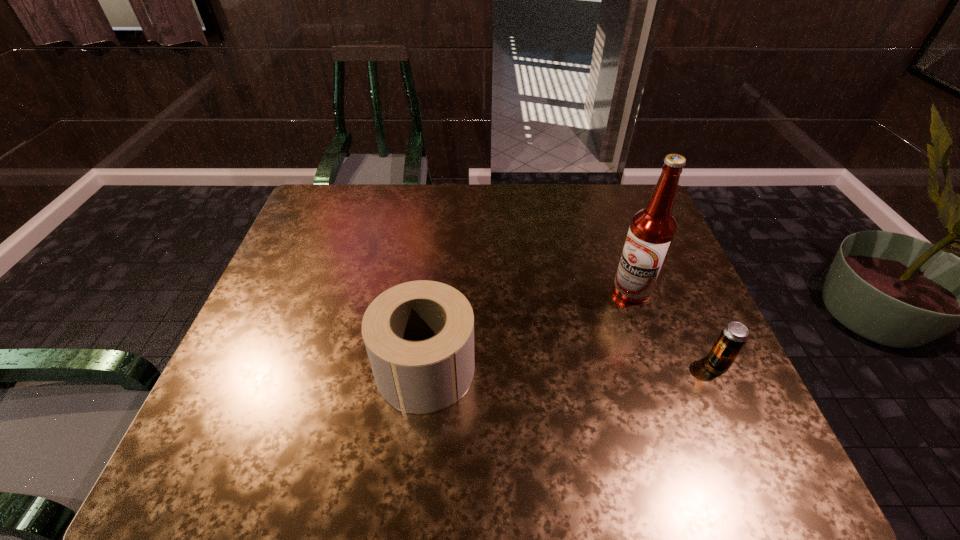
Locate an element on the screen. free spot located 0.380m on the label side of the second object from left to right is located at coordinates tap(564, 416).

Where is `object at the near edge`? The image size is (960, 540). object at the near edge is located at coordinates (419, 335).

You are a GUI agent. You are given a task and a screenshot of the screen. Output one action in this format:
    pyautogui.click(x=<x>, y=<y>)
    Task: Click on the beer can at the right edge
    
    Given the screenshot: What is the action you would take?
    pyautogui.click(x=733, y=337)

Locate an element on the screen. This screenshot has height=540, width=960. alcohol positioned at the right edge is located at coordinates (652, 230).

This screenshot has width=960, height=540. Find the location of `vacant space at the far edge of the desktop`. vacant space at the far edge of the desktop is located at coordinates (530, 224).

In the image, there is a desktop. Identify the location of vacant space at the near edge. [579, 399].

You are a GUI agent. You are given a task and a screenshot of the screen. Output one action in this format:
    pyautogui.click(x=<x>, y=<y>)
    Task: Click on the vacant region at the left edge of the desktop
    
    Given the screenshot: What is the action you would take?
    pyautogui.click(x=318, y=229)

Identify the location of vacant area at the right edge of the desktop. (676, 336).

Locate an element on the screen. This screenshot has height=540, width=960. free space at the far right corner is located at coordinates pos(606,193).

Locate an element on the screen. free point between the beer can and the second tallest object is located at coordinates (571, 366).